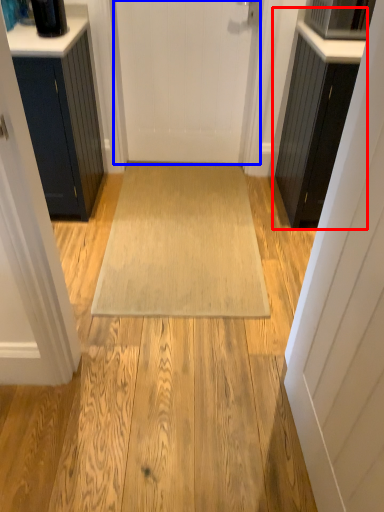
Question: Which object appears farthest to the camera in this image, cabinetry (highlighted by a red box) or door (highlighted by a blue box)?

Choices:
 (A) cabinetry
 (B) door

Answer: (B)